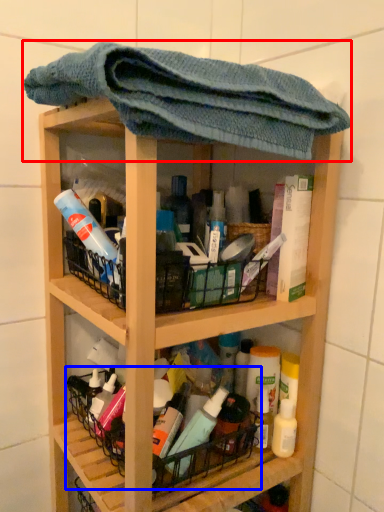
Question: Which point is closer to the camera, towel (highlighted by a red box) or basket (highlighted by a blue box)?

Choices:
 (A) towel
 (B) basket

Answer: (A)